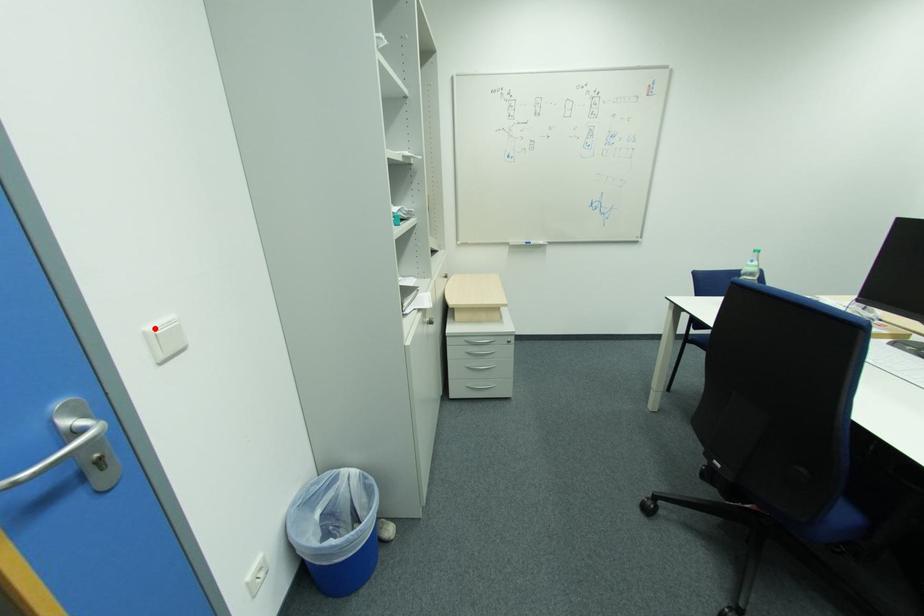
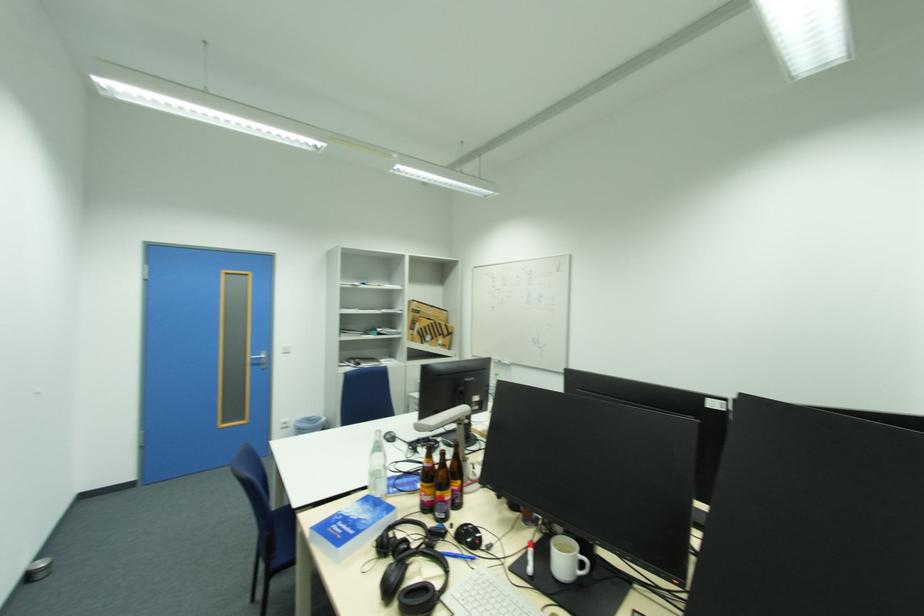
Where in the second image is the point corresponding to the highlighted location from the first image?

(289, 347)